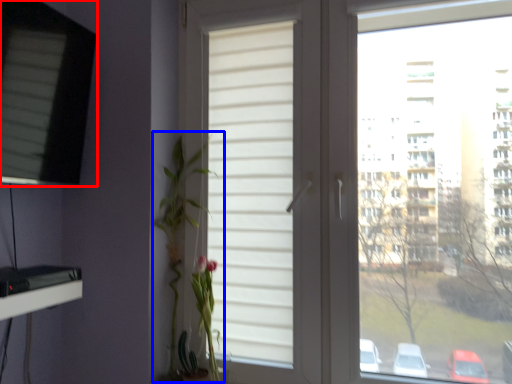
Question: Which of the following is the closest to the observer, window (highlighted by a red box) or floral arrangement (highlighted by a blue box)?

Choices:
 (A) window
 (B) floral arrangement

Answer: (A)